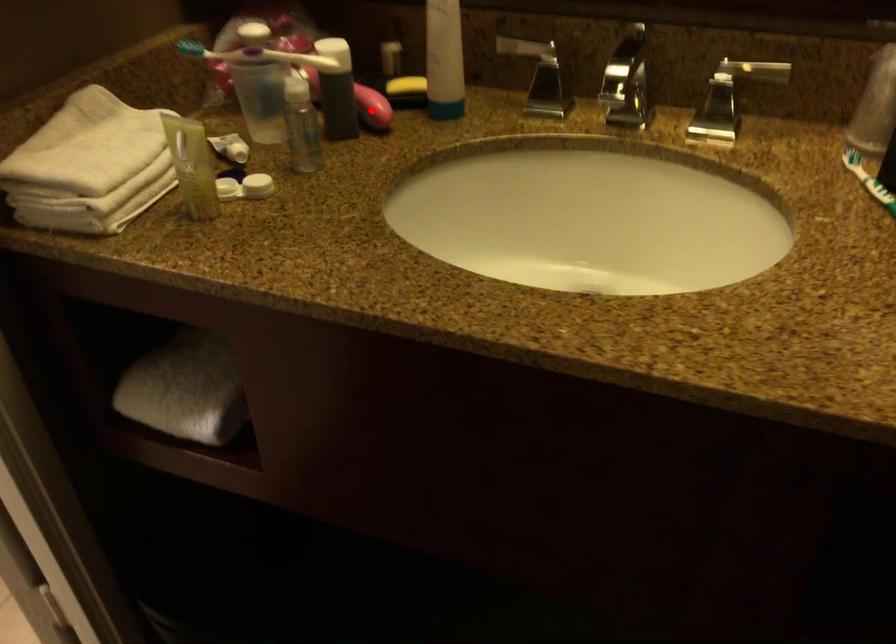
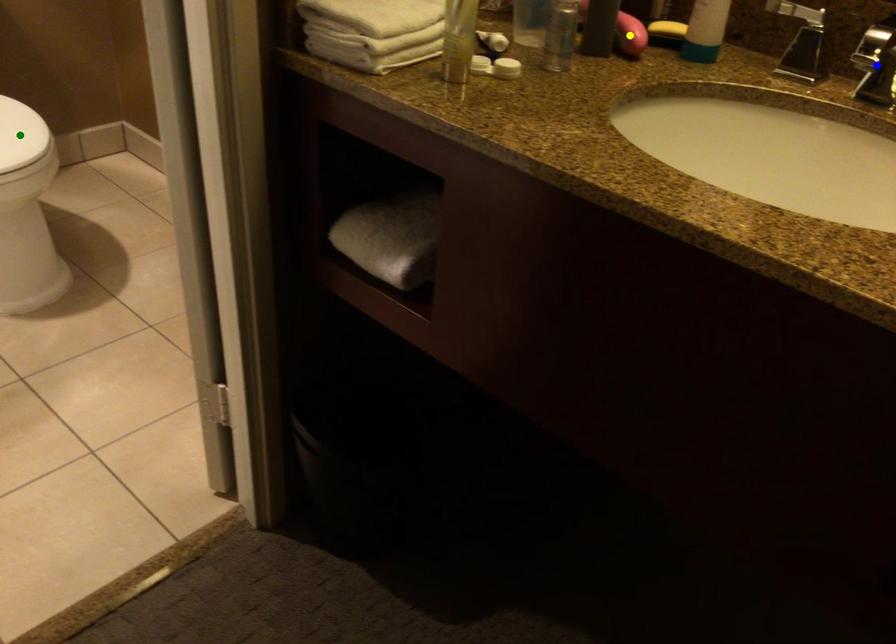
Question: I am providing you with two images of the same scene from different viewpoints. A red point is marked on the first image. You are given multiple points on the second image. Can you choose the point in image 2 that corresponds to the point in image 1?

Choices:
 (A) green point
 (B) blue point
 (C) yellow point

Answer: (C)